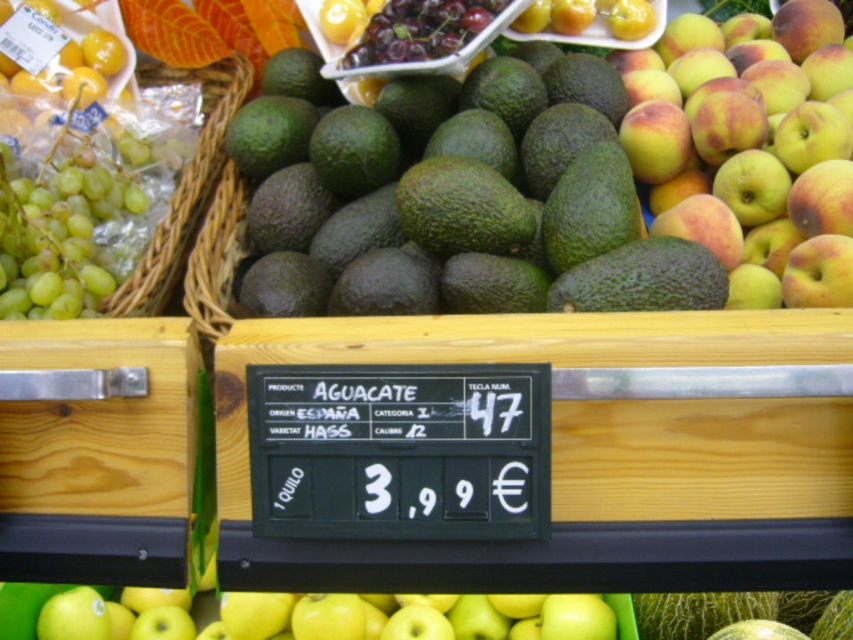
You are a customer at the fruit display and want to place a basket between the green matte avocado at center and the green matte grapes at left. The basket is 12 inches wide. Will it fit between them?

The distance between the green matte avocado at center and the green matte grapes at left is 16.49 inches. Since the basket is 12 inches wide, it will fit between them as there is enough space.

You are a customer at the fruit display and want to pick both the yellow matte apple at center and the green matte grapes at left. Which fruit should you pick first if you want to start from the left side of the display?

The green matte grapes at left are on the left side of the yellow matte apple at center, so you should pick the green matte grapes at left first.